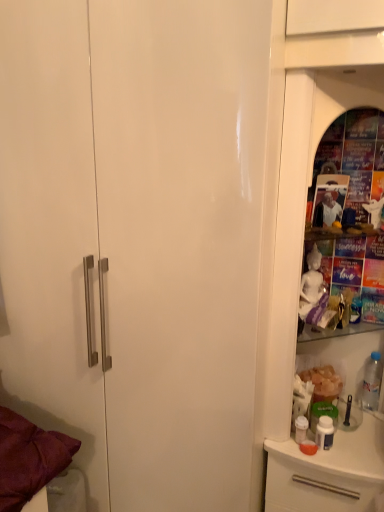
This screenshot has height=512, width=384. I want to click on white glossy dresser at right, so click(x=307, y=151).

In order to face white glossy dresser at right, should I rotate leftwards or rightwards?

To face it directly, rotate right by 19.578 degrees.

Image resolution: width=384 pixels, height=512 pixels. What do you see at coordinates (307, 151) in the screenshot?
I see `white glossy dresser at right` at bounding box center [307, 151].

What do you see at coordinates (372, 382) in the screenshot? I see `translucent plastic bottle at right` at bounding box center [372, 382].

This screenshot has width=384, height=512. What are the coordinates of `translucent plastic bottle at right` in the screenshot? It's located at (372, 382).

Where is `white glossy dresser at right`? This screenshot has height=512, width=384. white glossy dresser at right is located at coordinates (307, 151).

Considering the relative positions of translucent plastic bottle at right and white glossy dresser at right in the image provided, is translucent plastic bottle at right to the right of white glossy dresser at right from the viewer's perspective?

Yes, translucent plastic bottle at right is to the right of white glossy dresser at right.

Considering the positions of objects translucent plastic bottle at right and white glossy dresser at right in the image provided, who is in front, translucent plastic bottle at right or white glossy dresser at right?

white glossy dresser at right is in front.

Which is in front, point (369, 405) or point (292, 321)?

The point (292, 321) is closer.

From the image's perspective, which is above, translucent plastic bottle at right or white glossy dresser at right?

white glossy dresser at right, from the image's perspective.

From a real-world perspective, relative to white glossy dresser at right, is translucent plastic bottle at right vertically above or below?

translucent plastic bottle at right is below white glossy dresser at right.

Is translucent plastic bottle at right thinner than white glossy dresser at right?

Correct, the width of translucent plastic bottle at right is less than that of white glossy dresser at right.

Does translucent plastic bottle at right have a greater height compared to white glossy dresser at right?

In fact, translucent plastic bottle at right may be shorter than white glossy dresser at right.

Looking at the image, does translucent plastic bottle at right seem bigger or smaller compared to white glossy dresser at right?

In the image, translucent plastic bottle at right appears to be smaller than white glossy dresser at right.

Choose the correct answer: Is translucent plastic bottle at right inside white glossy dresser at right or outside it?

translucent plastic bottle at right is located inside white glossy dresser at right.

Is translucent plastic bottle at right touching white glossy dresser at right?

There is a gap between translucent plastic bottle at right and white glossy dresser at right.

Is translucent plastic bottle at right positioned with its back to white glossy dresser at right?

Yes, translucent plastic bottle at right is facing away from white glossy dresser at right.

Find the location of a particular element. dresser located on the left of translucent plastic bottle at right is located at coordinates (307, 151).

Would you say white glossy dresser at right is to the left or to the right of translucent plastic bottle at right in the picture?

white glossy dresser at right is positioned on translucent plastic bottle at right's left side.

Is white glossy dresser at right closer to the viewer compared to translucent plastic bottle at right?

Yes, white glossy dresser at right is closer to the viewer.

Does point (291, 153) come behind point (373, 367)?

No, it is in front of (373, 367).

From the image's perspective, who appears lower, white glossy dresser at right or translucent plastic bottle at right?

From the image's view, translucent plastic bottle at right is below.

From a real-world perspective, is white glossy dresser at right above or below translucent plastic bottle at right?

From a real-world perspective, white glossy dresser at right is physically above translucent plastic bottle at right.

Is white glossy dresser at right thinner than translucent plastic bottle at right?

No.

Who is taller, white glossy dresser at right or translucent plastic bottle at right?

white glossy dresser at right is taller.

Which of these two, white glossy dresser at right or translucent plastic bottle at right, is smaller?

translucent plastic bottle at right.

Would you say white glossy dresser at right is outside translucent plastic bottle at right?

Yes, white glossy dresser at right is located beyond the bounds of translucent plastic bottle at right.

Is white glossy dresser at right with translucent plastic bottle at right?

white glossy dresser at right and translucent plastic bottle at right are clearly separated.

Is white glossy dresser at right looking in the opposite direction of translucent plastic bottle at right?

Correct, white glossy dresser at right is looking away from translucent plastic bottle at right.

Find the location of a particular element. The width and height of the screenshot is (384, 512). dresser located in front of the translucent plastic bottle at right is located at coordinates (307, 151).

Identify the location of dresser on the left of translucent plastic bottle at right. Image resolution: width=384 pixels, height=512 pixels. coord(307,151).

At what (x,y) coordinates should I click in order to perform the action: click on dresser that appears above the translucent plastic bottle at right (from a real-world perspective). Please return your answer as a coordinate pair (x, y). The image size is (384, 512). Looking at the image, I should click on (307, 151).